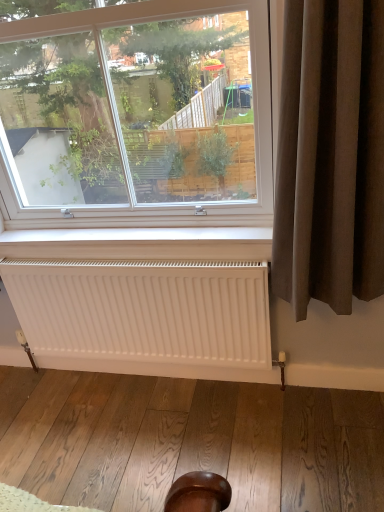
Question: Considering the relative positions of white matte radiator at lower center and brown fabric curtain at right in the image provided, is white matte radiator at lower center to the left of brown fabric curtain at right from the viewer's perspective?

Choices:
 (A) no
 (B) yes

Answer: (B)

Question: Does white matte radiator at lower center come in front of brown fabric curtain at right?

Choices:
 (A) yes
 (B) no

Answer: (B)

Question: Can you confirm if white matte radiator at lower center is bigger than brown fabric curtain at right?

Choices:
 (A) no
 (B) yes

Answer: (A)

Question: From the image's perspective, is white matte radiator at lower center over brown fabric curtain at right?

Choices:
 (A) yes
 (B) no

Answer: (B)

Question: From a real-world perspective, is white matte radiator at lower center over brown fabric curtain at right?

Choices:
 (A) no
 (B) yes

Answer: (A)

Question: Considering the relative sizes of white matte radiator at lower center and brown fabric curtain at right in the image provided, is white matte radiator at lower center taller than brown fabric curtain at right?

Choices:
 (A) yes
 (B) no

Answer: (B)

Question: Does brown fabric curtain at right appear on the right side of clear glass window at upper center?

Choices:
 (A) no
 (B) yes

Answer: (B)

Question: Is brown fabric curtain at right facing away from clear glass window at upper center?

Choices:
 (A) yes
 (B) no

Answer: (B)

Question: Considering the relative sizes of brown fabric curtain at right and clear glass window at upper center in the image provided, is brown fabric curtain at right bigger than clear glass window at upper center?

Choices:
 (A) yes
 (B) no

Answer: (B)

Question: Considering the relative positions of brown fabric curtain at right and clear glass window at upper center in the image provided, is brown fabric curtain at right to the left of clear glass window at upper center from the viewer's perspective?

Choices:
 (A) yes
 (B) no

Answer: (B)

Question: Considering the relative positions of brown fabric curtain at right and clear glass window at upper center in the image provided, is brown fabric curtain at right in front of clear glass window at upper center?

Choices:
 (A) yes
 (B) no

Answer: (A)

Question: Is brown fabric curtain at right next to clear glass window at upper center?

Choices:
 (A) yes
 (B) no

Answer: (B)

Question: Is white matte radiator at lower center surrounding clear glass window at upper center?

Choices:
 (A) yes
 (B) no

Answer: (B)